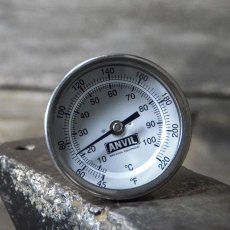
The width and height of the screenshot is (230, 230). I want to click on thermometer, so click(x=124, y=122).